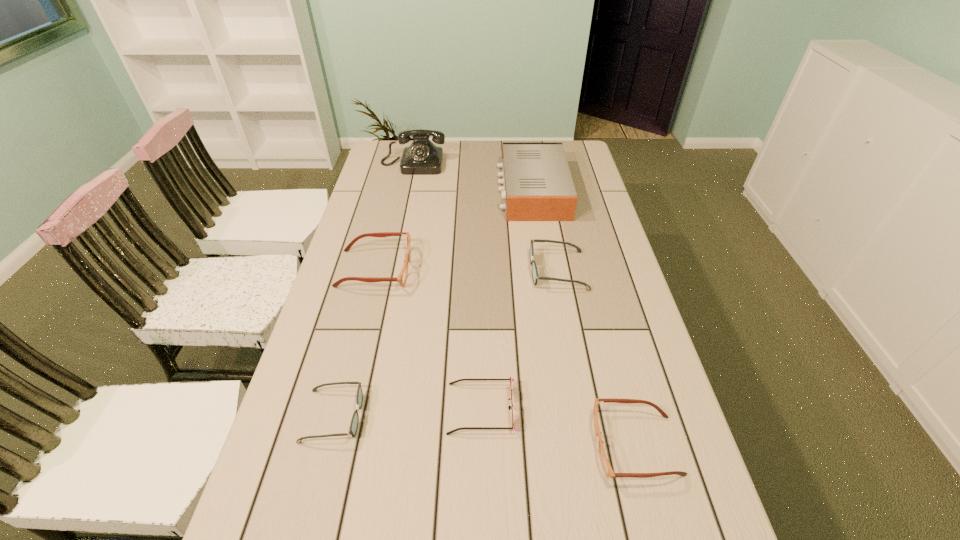
At what (x,y) coordinates should I click in order to perform the action: click on black telephone. Please return your answer as a coordinate pair (x, y). Image resolution: width=960 pixels, height=540 pixels. Looking at the image, I should click on (422, 157).

Locate an element on the screen. The height and width of the screenshot is (540, 960). the tallest object is located at coordinates (422, 157).

Identify the location of radio receiver. The height and width of the screenshot is (540, 960). (537, 184).

The width and height of the screenshot is (960, 540). In order to click on the left brown spectacles in this screenshot , I will do `click(401, 279)`.

Where is `the bigger brown spectacles`? Image resolution: width=960 pixels, height=540 pixels. the bigger brown spectacles is located at coordinates (401, 279).

This screenshot has height=540, width=960. I want to click on the right gray spectacles, so click(x=535, y=276).

Locate an element on the screen. This screenshot has width=960, height=540. the farther gray spectacles is located at coordinates (535, 276).

Find the location of `the right brown spectacles`. the right brown spectacles is located at coordinates (606, 465).

Identify the location of the smaller brown spectacles. This screenshot has width=960, height=540. (606, 465).

Identify the location of sunglasses. The image size is (960, 540). (511, 379).